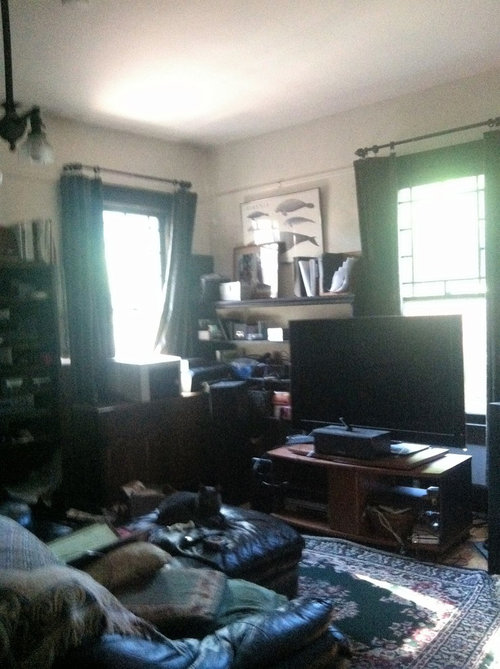
I want to click on blanket with fringe, so click(x=55, y=595).